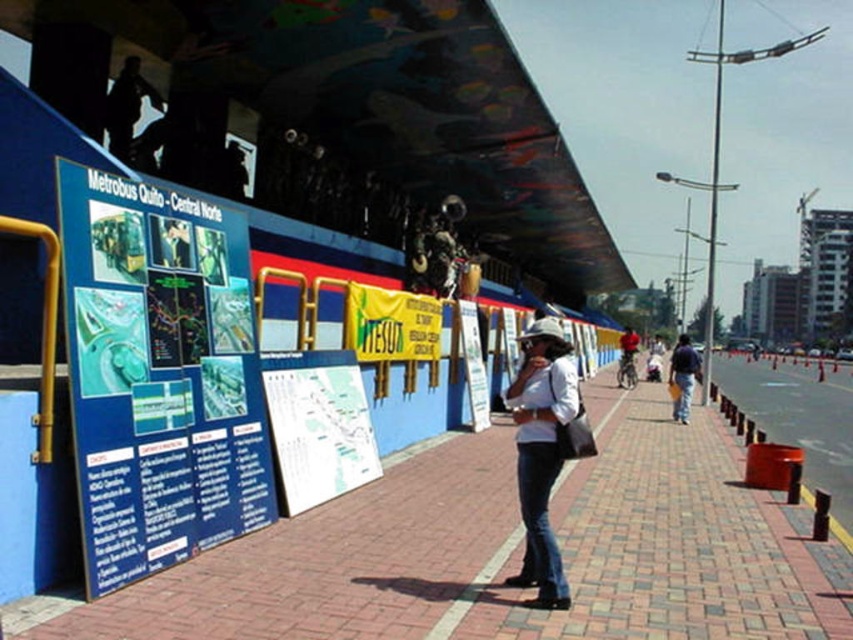
You are a passenger at the Metrobus Quito Central Norte station. You see an orange plastic barrier at right and dark blue jeans at center. Which object is closer to the ground?

The orange plastic barrier at right is positioned under dark blue jeans at center, so the orange plastic barrier at right is closer to the ground.

You are a passenger at the Metrobus Quito Central Norte station. You see an orange plastic barrier at right and dark blue jeans at center. Which object is positioned to the right side of the other?

The orange plastic barrier at right is to the right of dark blue jeans at center.

You are a passenger at the Metrobus Quito Central Norte station. You see an orange plastic barrier at right and a white cotton shirt at center. Which object is closer to the ground?

The orange plastic barrier at right is below the white cotton shirt at center, meaning it is closer to the ground.